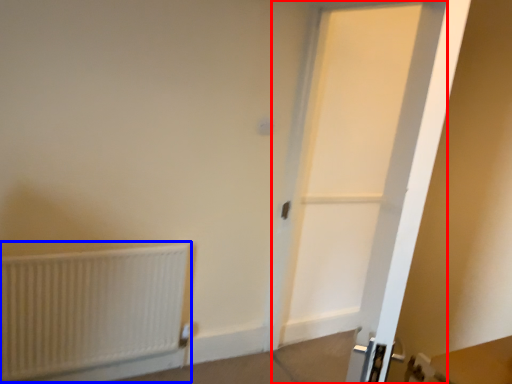
Question: Which point is closer to the camera, door (highlighted by a red box) or radiator (highlighted by a blue box)?

Choices:
 (A) door
 (B) radiator

Answer: (A)